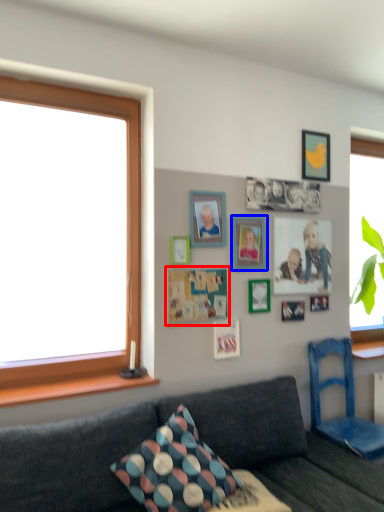
Question: Which object appears closest to the camera in this image, bulletin board (highlighted by a red box) or picture frame (highlighted by a blue box)?

Choices:
 (A) bulletin board
 (B) picture frame

Answer: (A)